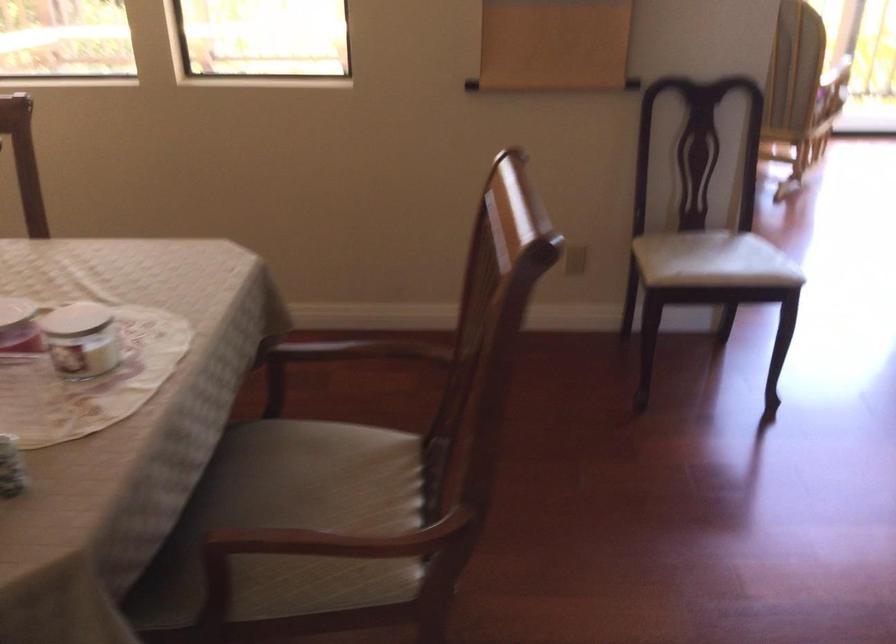
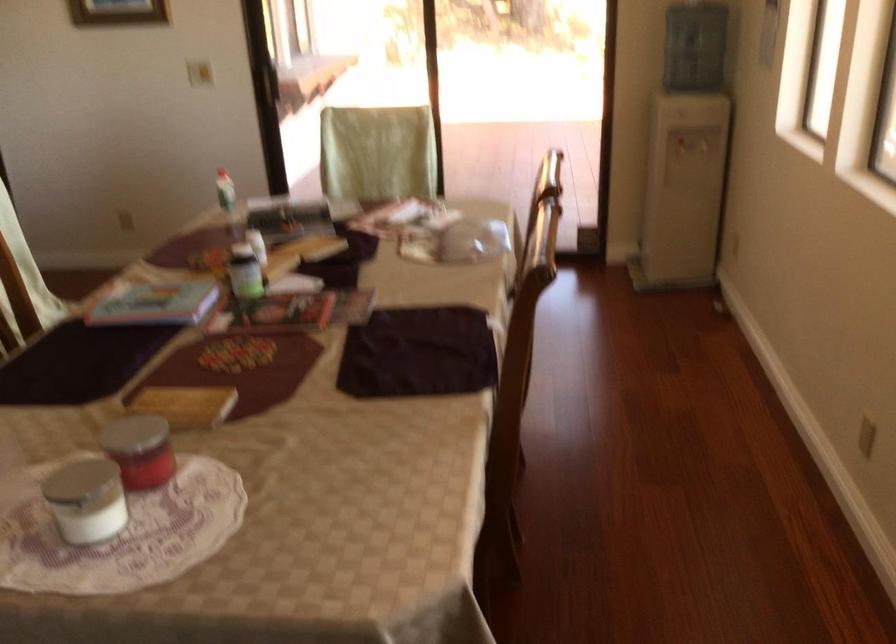
Find the pixel in the second image that matches the point at 113,319 in the first image.

(85, 500)